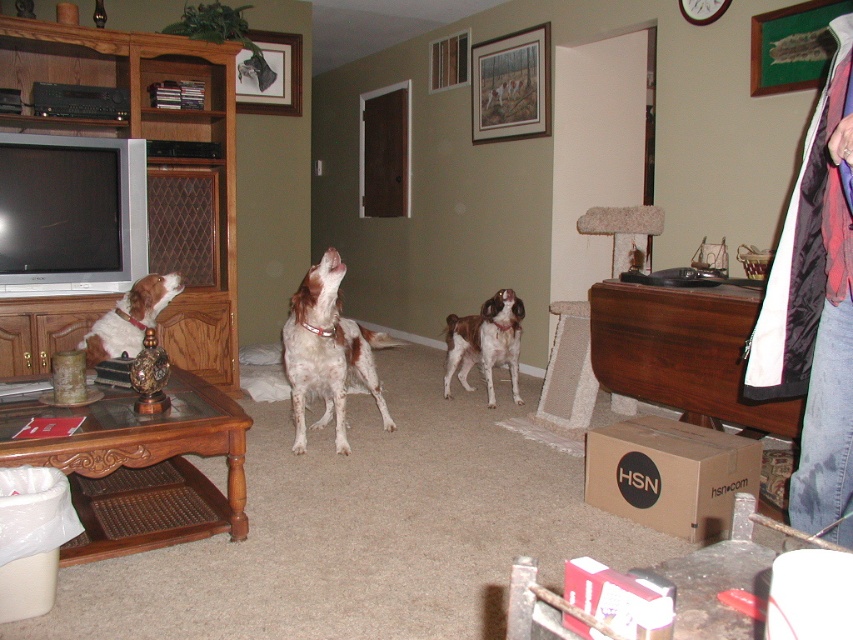
You are a delivery person who needs to place a package on the wooden entertainment center at left. However, the denim jacket at lower right is in the way. Can you move the denim jacket to make space?

The wooden entertainment center at left is positioned over the denim jacket at lower right, meaning the jacket is directly beneath it. Since the jacket is already under the entertainment center, you cannot move it without first removing it from its current position.

You are standing at the point marked by coordinates point (363, 349) and want to reach the TV on the left side of the room. Considering the distance between you and the TV is 11.34 feet, can you estimate how many steps it would take if each step covers approximately 2.5 feet?

The distance between you and the TV is 11.34 feet. Since each step covers about 2.5 feet, dividing 11.34 by 2.5 gives approximately 4.536 steps. Rounding up, it would take around 5 steps to reach the TV.